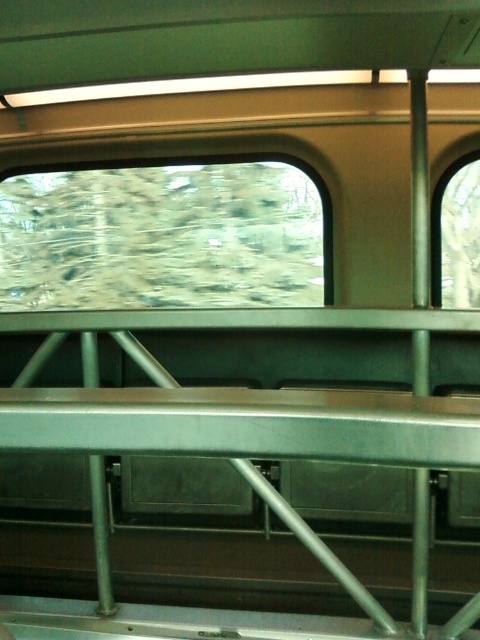
You are a passenger in the train car and want to see the outside view clearly. Which window should you choose between the transparent glass window at center and the clear glass window at right?

The transparent glass window at center is larger in size than the clear glass window at right, so you should choose the transparent glass window at center to see the outside view clearly because it offers a wider view.

You are a passenger sitting in the train car. You want to look outside through the clear glass window at right. Can you reach it without moving past the transparent glass window at center?

The clear glass window at right is behind the transparent glass window at center, so you would need to move past the transparent glass window at center to reach the clear glass window at right.

You are inside the train car and want to look outside through the transparent glass window at center. Where exactly should you look to see the view outside? Please provide the coordinates in the format of point followed by numbers.

You should look at point (162, 237) to see the view outside through the transparent glass window at center.